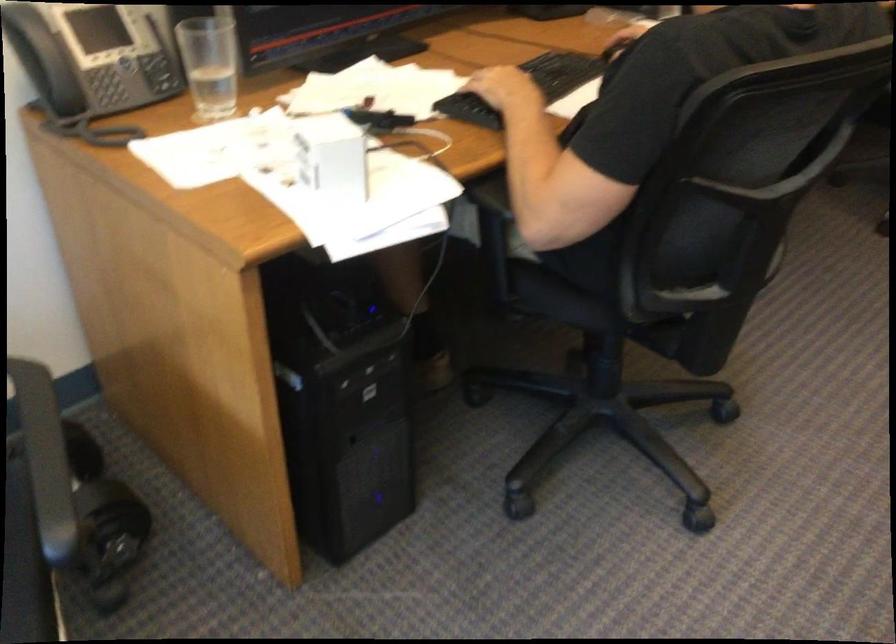
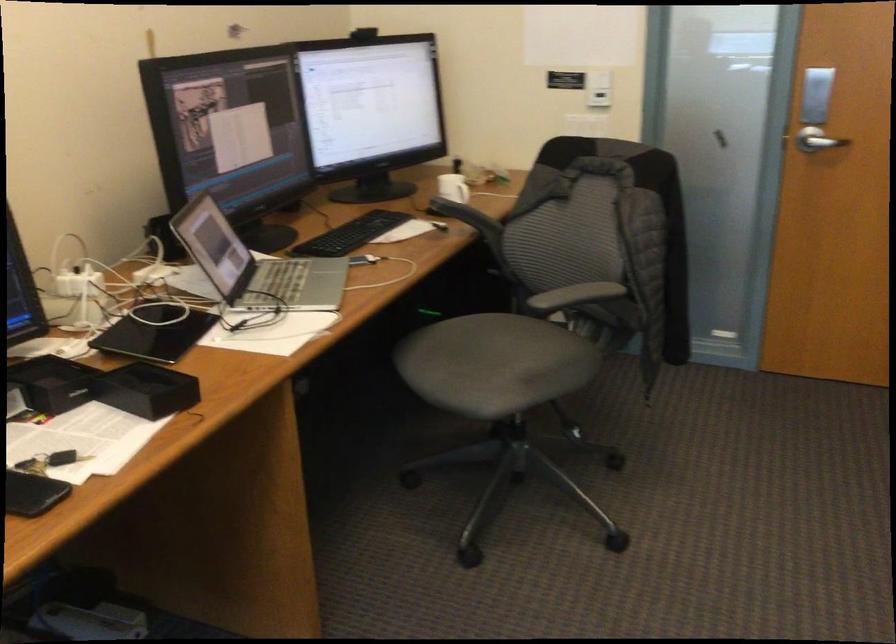
In a continuous first-person perspective shot, in which direction is the camera moving?

The cameraman moved toward right, forward.